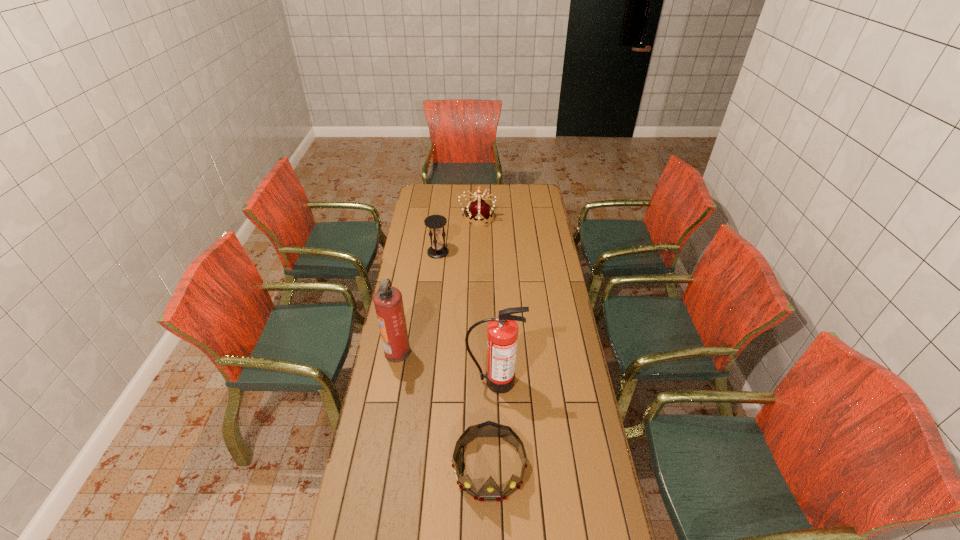
At what (x,y) coordinates should I click in order to perform the action: click on the third farthest object. Please return your answer as a coordinate pair (x, y). Looking at the image, I should click on 388,302.

This screenshot has width=960, height=540. I want to click on the leftmost object, so click(x=388, y=302).

In order to click on the fourth farthest object in this screenshot , I will do `click(502, 332)`.

The height and width of the screenshot is (540, 960). I want to click on the nearer fire extinguisher, so click(x=502, y=332).

You are a GUI agent. You are given a task and a screenshot of the screen. Output one action in this format:
    pyautogui.click(x=<x>, y=<y>)
    Task: Click on the taller tiara
    
    Given the screenshot: What is the action you would take?
    pyautogui.click(x=479, y=210)

The width and height of the screenshot is (960, 540). What are the coordinates of `the farther tiara` in the screenshot? It's located at (479, 210).

Where is `the fourth object from right to left`? The image size is (960, 540). the fourth object from right to left is located at coordinates (437, 250).

Where is `hourglass`? This screenshot has height=540, width=960. hourglass is located at coordinates (437, 250).

This screenshot has height=540, width=960. Find the location of `the nearest object`. the nearest object is located at coordinates (490, 491).

You are a GUI agent. You are given a task and a screenshot of the screen. Output one action in this format:
    pyautogui.click(x=<x>, y=<y>)
    Task: Click on the nearer tiara
    This screenshot has width=960, height=540.
    Given the screenshot: What is the action you would take?
    pyautogui.click(x=490, y=491)